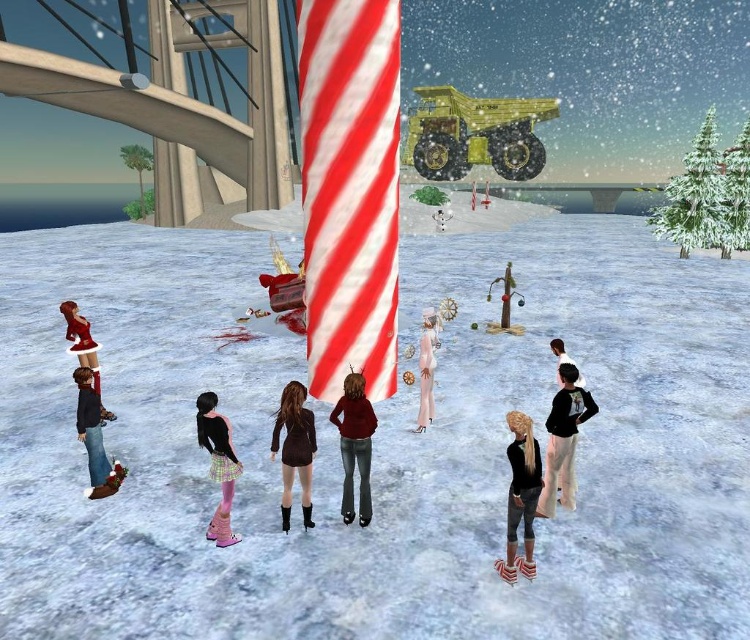
You are standing in the snowy scene and notice two items near the candy pole. The black matte boots at lower right and the velvet red dress at left. Which item is taller?

The black matte boots at lower right is taller than the velvet red dress at left.

You are standing in the snowy scene and notice both the white fluffy snow at center and the white fluffy dress at center. From your perspective, which one is positioned to the right?

The white fluffy snow at center is to the right of the white fluffy dress at center.